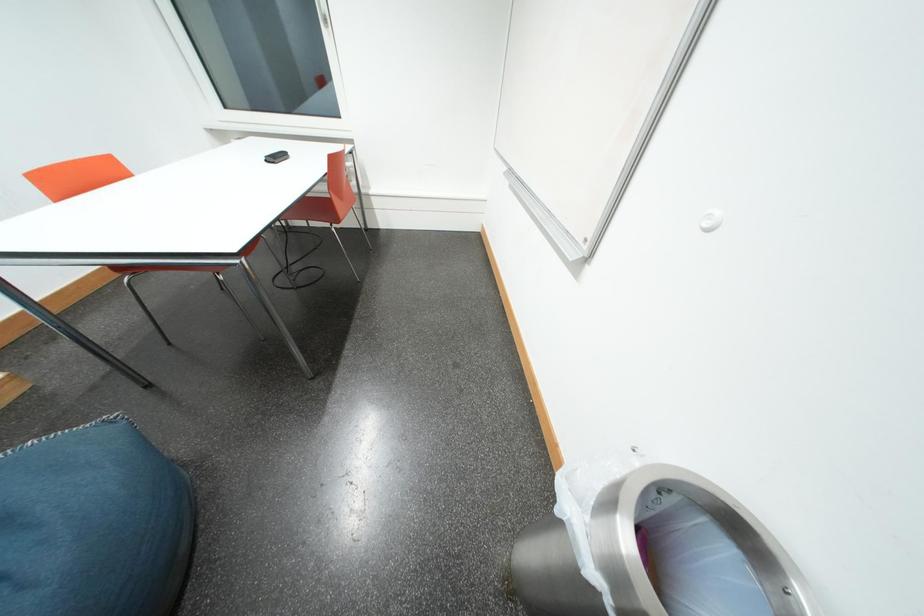
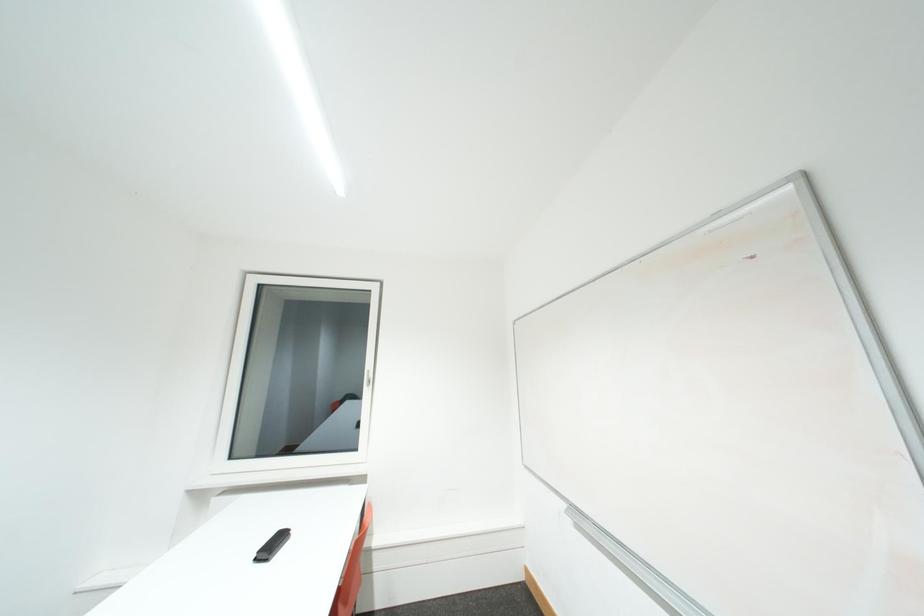
Question: The images are taken continuously from a first-person perspective. In which direction is your viewpoint rotating?

Choices:
 (A) Left
 (B) Right
 (C) Up
 (D) Down

Answer: (C)